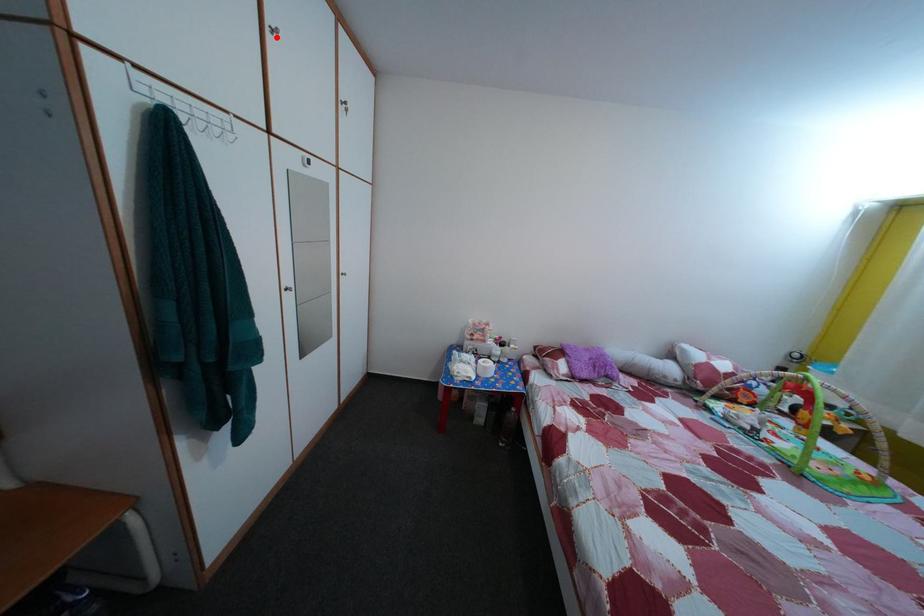
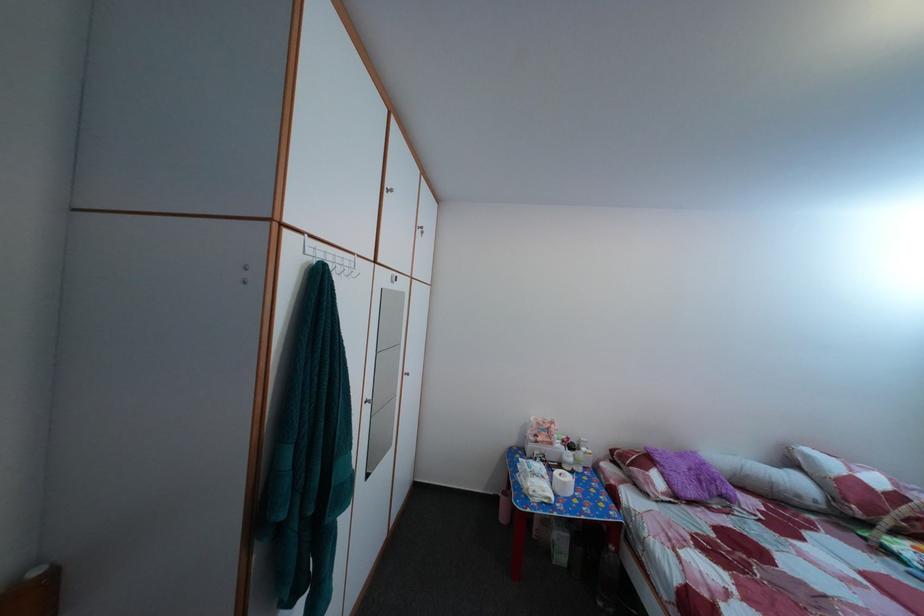
Where in the second image is the point corresponding to the highlighted location from the first image?

(395, 198)